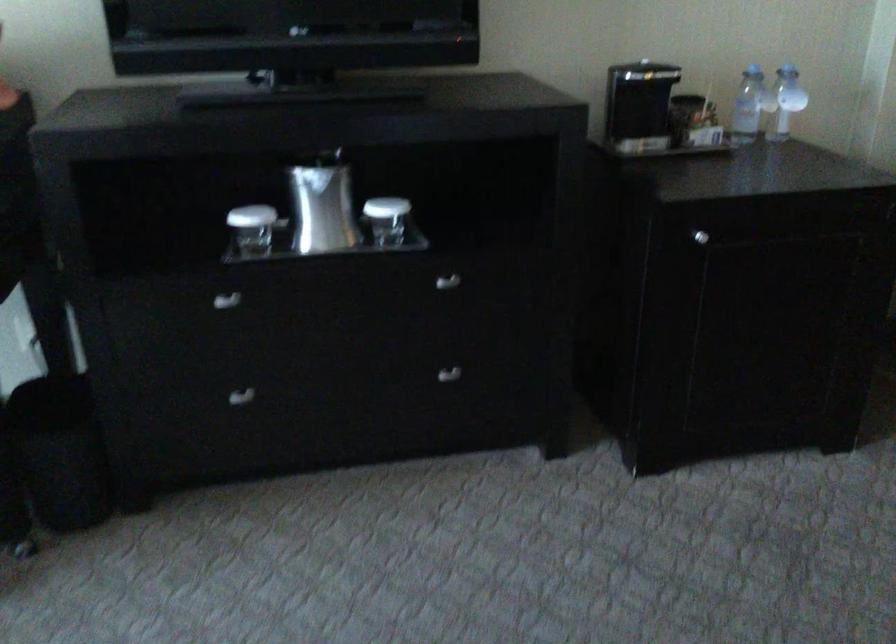
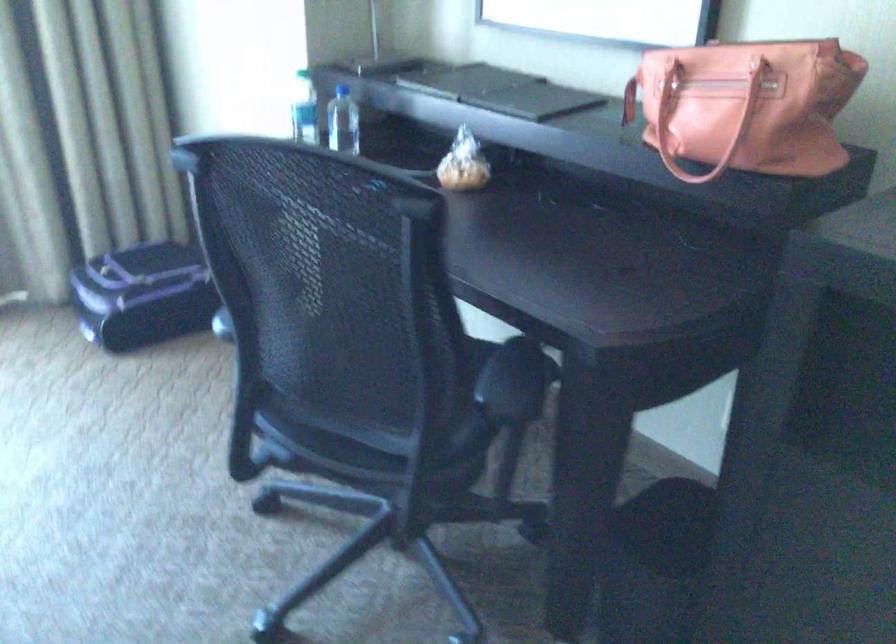
Question: How did the camera likely rotate?

Choices:
 (A) Left
 (B) Right
 (C) Up
 (D) Down

Answer: (A)